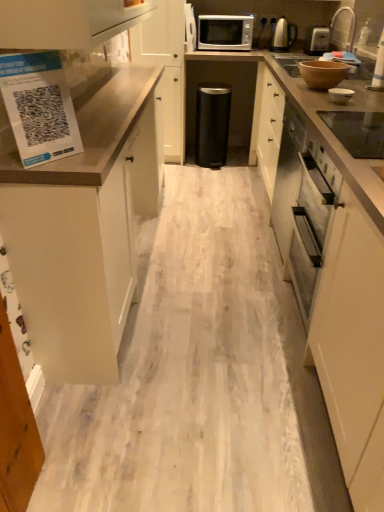
Where is `vacant space underneath white matte cabinet at left, acting as the 1th cabinetry starting from the front (from a real-world perspective)`? This screenshot has width=384, height=512. vacant space underneath white matte cabinet at left, acting as the 1th cabinetry starting from the front (from a real-world perspective) is located at coordinates (147, 247).